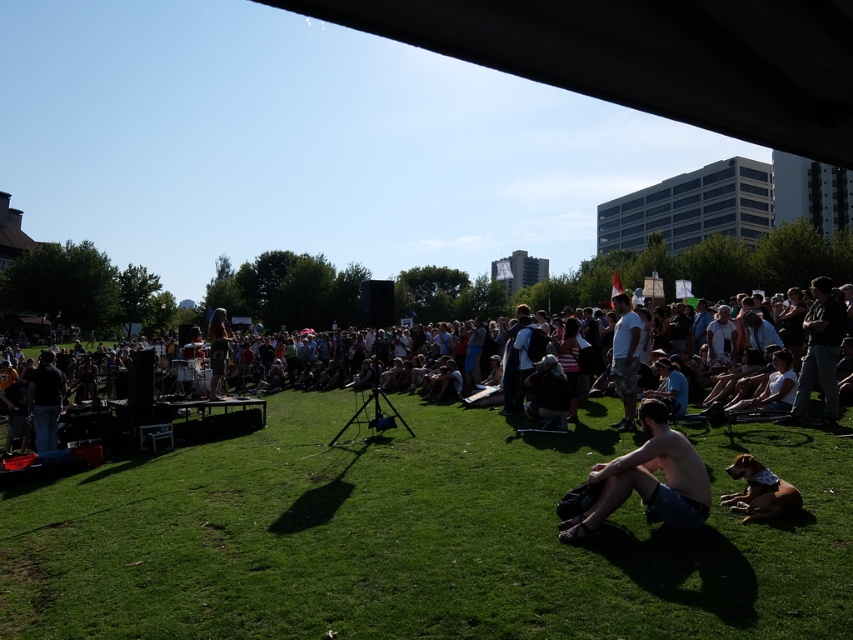
Is shiny blue shorts at lower center below white cotton t-shirt at center?

Indeed, shiny blue shorts at lower center is positioned under white cotton t-shirt at center.

Can you confirm if shiny blue shorts at lower center is wider than white cotton t-shirt at center?

Yes.

Is point (630, 456) more distant than point (628, 380)?

No.

Where is `shiny blue shorts at lower center`? The height and width of the screenshot is (640, 853). shiny blue shorts at lower center is located at coordinates click(648, 481).

This screenshot has height=640, width=853. Describe the element at coordinates (45, 401) in the screenshot. I see `dark gray shirt at left` at that location.

Is point (51, 403) farther from viewer compared to point (509, 374)?

No, (51, 403) is in front of (509, 374).

Identify the location of dark gray shirt at left. (45, 401).

Does shiny blue shorts at lower center have a lesser width compared to dark gray jeans at center?

Indeed, shiny blue shorts at lower center has a lesser width compared to dark gray jeans at center.

Who is more forward, (575,541) or (839,330)?

Point (575,541) is in front.

This screenshot has width=853, height=640. What are the coordinates of `shiny blue shorts at lower center` in the screenshot? It's located at (648, 481).